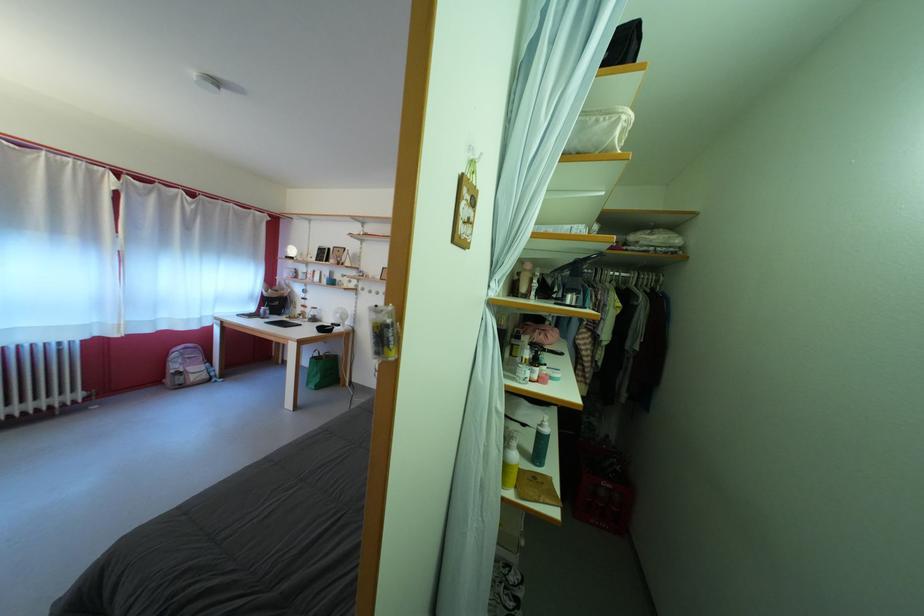
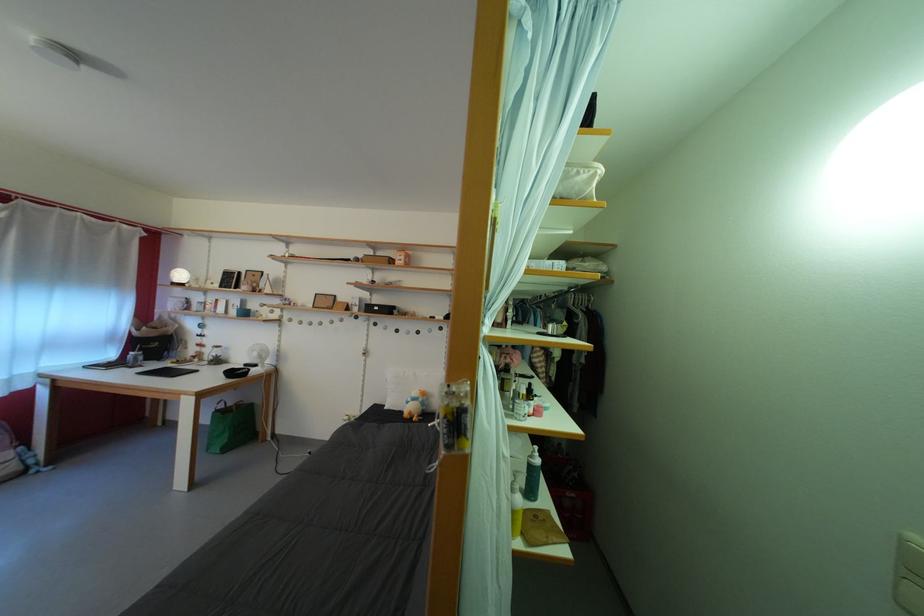
Locate, in the second image, the point that corresponds to point (322, 363) in the first image.

(225, 416)